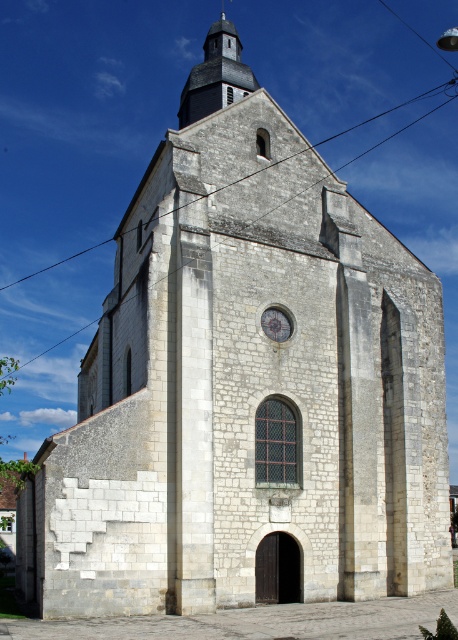
You are standing in front of the historic stone church and want to take a photo of the smooth gray spire at upper center. If your camera has a maximum zoom range of 50 meters, will you be able to capture the spire clearly in your photo?

The distance between the smooth gray spire at upper center and the viewer is 67.83 meters. Since the camera can only zoom up to 50 meters, you won not be able to capture the spire clearly at this distance.

You are standing in front of the historic stone church and want to take a photo of the matte gray clock at center without the smooth gray spire at upper center blocking it. How should you position yourself to achieve this?

The matte gray clock at center is behind the smooth gray spire at upper center. To take a photo of the matte gray clock at center without the spire blocking it, you should move to a position where the spire is no longer in front of the clock, such as moving to the side or adjusting your angle so that the clock becomes visible beyond the spire.